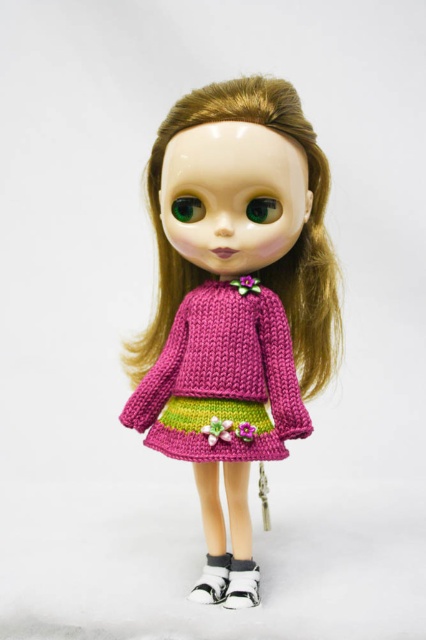
Based on the description provided, which clothing item on the doll is longer in height between the knitted pink sweater at center and the knitted pink dress at center?

The knitted pink sweater at center is taller than the knitted pink dress at center, so the sweater is longer in height.

You are a toy designer examining the doll and notice both the knitted pink sweater at center and the knitted pink dress at center. Which piece of clothing is covering the other?

The knitted pink sweater at center is in front of the knitted pink dress at center, so the sweater is covering the dress.